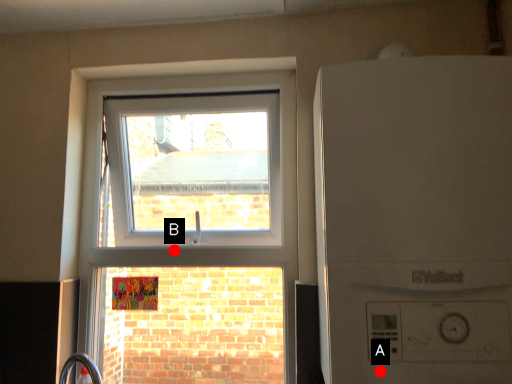
Question: Two points are circled on the image, labeled by A and B beside each circle. Which of the following is the farthest from the observer?

Choices:
 (A) A is further
 (B) B is further

Answer: (B)